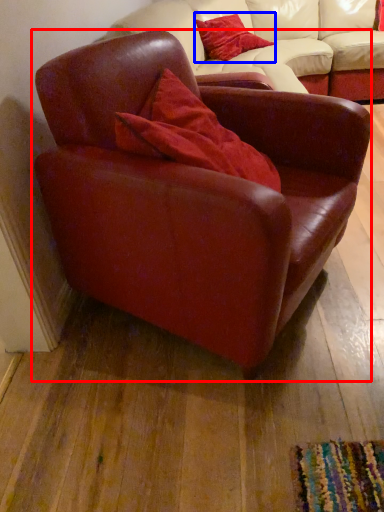
Question: Which of the following is the closest to the observer, chair (highlighted by a red box) or pillow (highlighted by a blue box)?

Choices:
 (A) chair
 (B) pillow

Answer: (A)